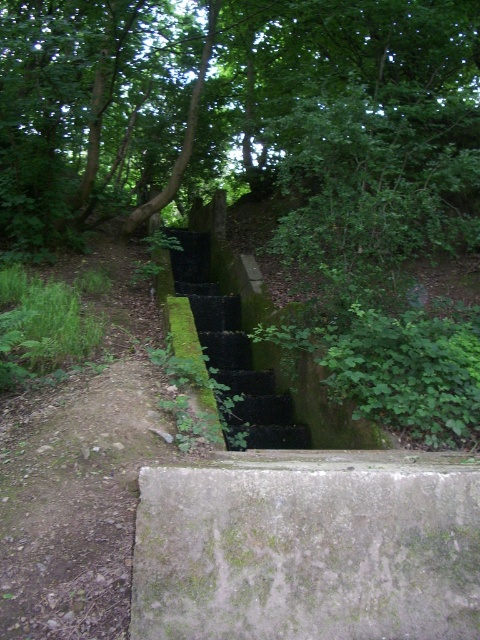
Which is behind, point (122, 65) or point (284, 556)?

The point (122, 65) is behind.

Locate an element on the screen. This screenshot has height=640, width=480. green leafy tree at upper center is located at coordinates (210, 96).